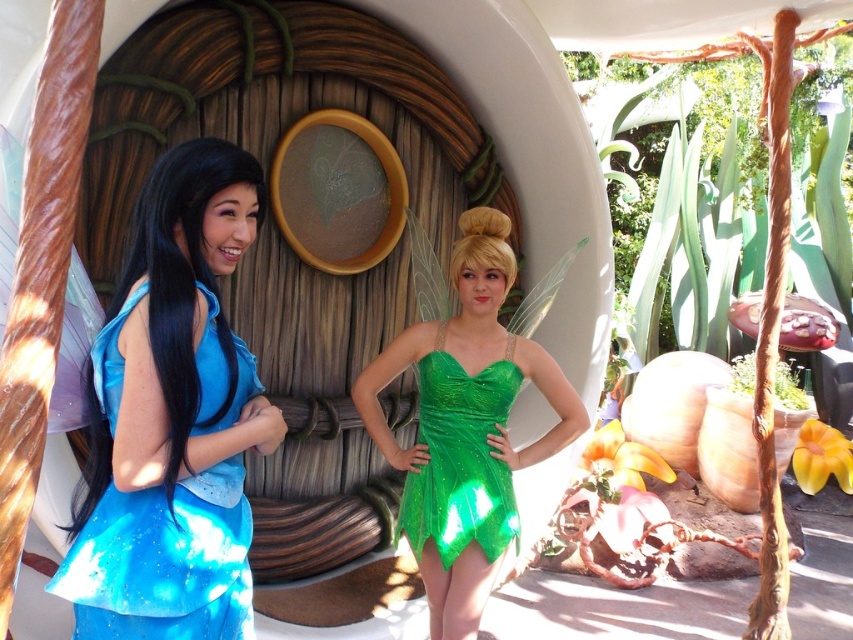
You are a photographer setting up for a group photo. You need to position two fairy costumes so that there is at least 4 feet of space between them to allow for proper lighting. The green sparkly dress at center and the shiny blue dress at left are currently positioned how far apart? Is the current distance sufficient for your lighting setup?

The green sparkly dress at center and the shiny blue dress at left are currently 3.78 feet apart. Since the required distance is at least 4 feet, the current spacing is insufficient for the lighting setup.

You are a photographer at a fairy costume photoshoot. You need to adjust the lighting so that the green sparkly dress at center and the green glittery dress at center are both visible. Which dress should you focus the light on first?

The green sparkly dress at center is above the green glittery dress at center, so you should focus the light on the green sparkly dress at center first to ensure it is properly illuminated before adjusting for the lower one.

Consider the image. You are taking a photo of two fairies in a fairy tale setting. You want to focus on the fairy at point (511, 496) and the fairy at point (138, 595). Which fairy is closer to the camera?

The fairy at point (511, 496) is closer to the camera than the fairy at point (138, 595) because point (511, 496) is further to the camera than point (138, 595).